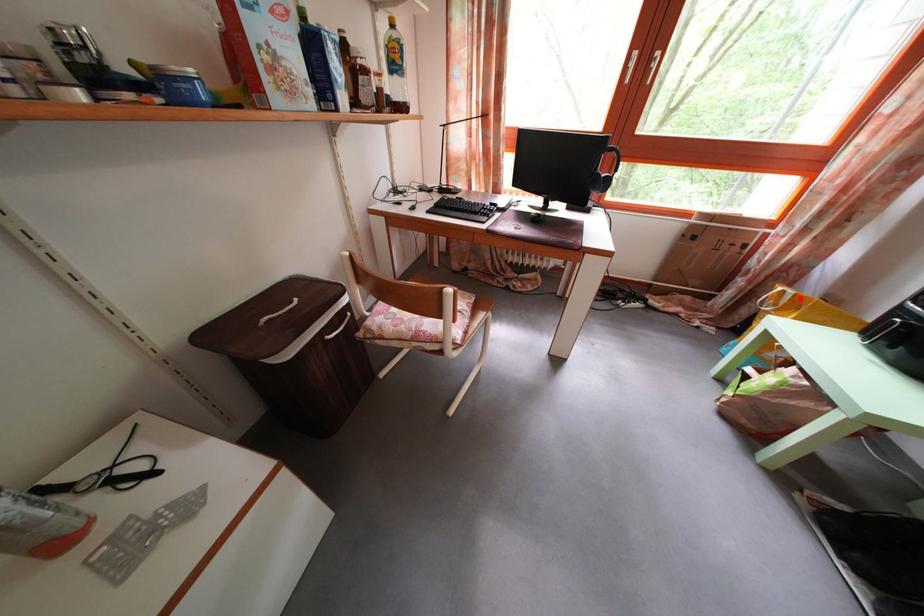
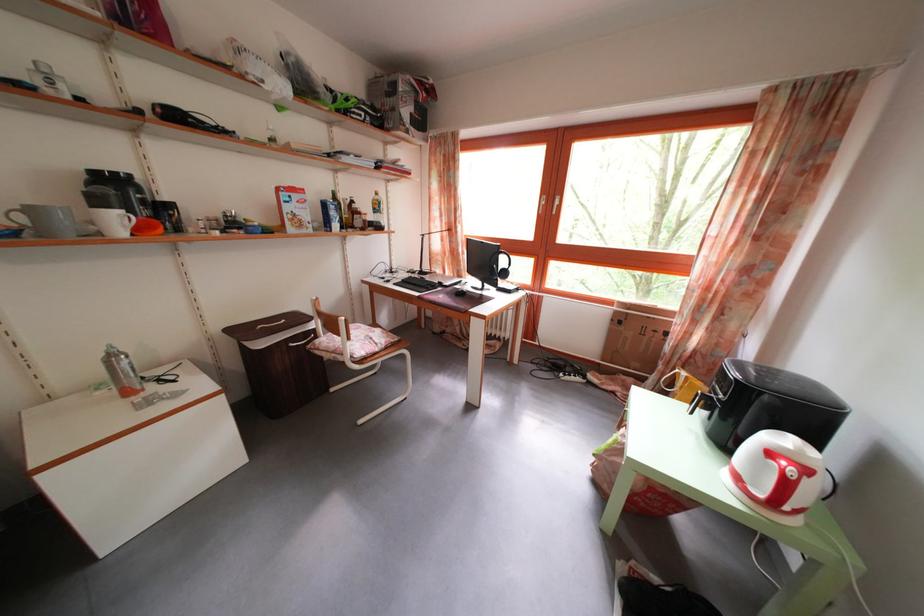
Question: I am providing you with two images of the same scene from different viewpoints. A red point is shown in image1. For the corresponding object point in image2, is it positioned nearer or farther from the camera?

Choices:
 (A) Nearer
 (B) Farther

Answer: (A)